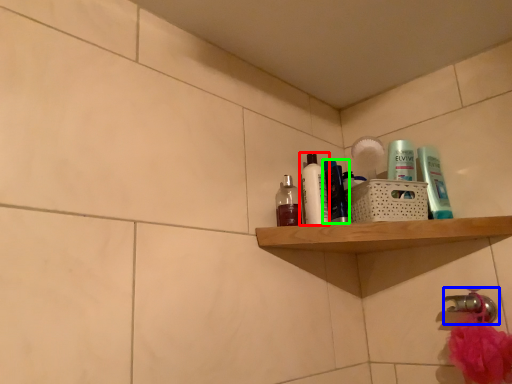
Question: Considering the real-world distances, which object is farthest from toiletry (highlighted by a red box)? tap (highlighted by a blue box) or toiletry (highlighted by a green box)?

Choices:
 (A) tap
 (B) toiletry

Answer: (A)